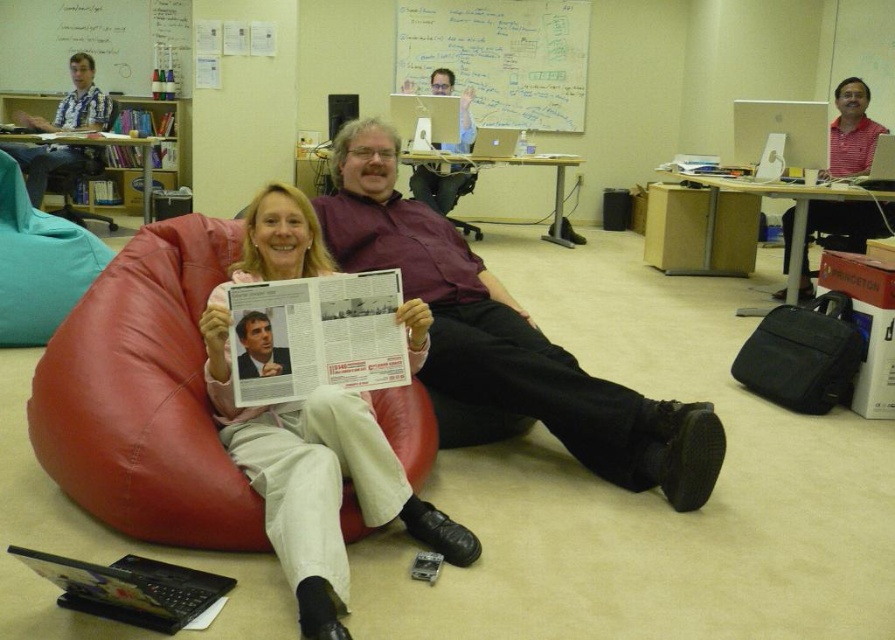
Which is in front, point (435, 424) or point (432, 1)?

Point (435, 424) is in front.

Can you confirm if red leather bean bag chair at center is positioned to the right of whiteboard at upper center?

In fact, red leather bean bag chair at center is to the left of whiteboard at upper center.

Is point (396, 445) farther from camera compared to point (472, 35)?

No, it is in front of (472, 35).

I want to click on red leather bean bag chair at center, so click(145, 396).

Is whiteboard at upper left to the left of matte black shirt at center from the viewer's perspective?

Correct, you'll find whiteboard at upper left to the left of matte black shirt at center.

Who is lower down, whiteboard at upper left or matte black shirt at center?

matte black shirt at center is lower down.

Locate an element on the screen. whiteboard at upper left is located at coordinates (92, 42).

Who is positioned more to the left, red leather bean bag chair at center or light pink fabric pants at center?

red leather bean bag chair at center

Which is behind, point (211, 253) or point (369, 403)?

The point (211, 253) is more distant.

I want to click on red leather bean bag chair at center, so click(145, 396).

Where is `red leather bean bag chair at center`? The height and width of the screenshot is (640, 895). red leather bean bag chair at center is located at coordinates [145, 396].